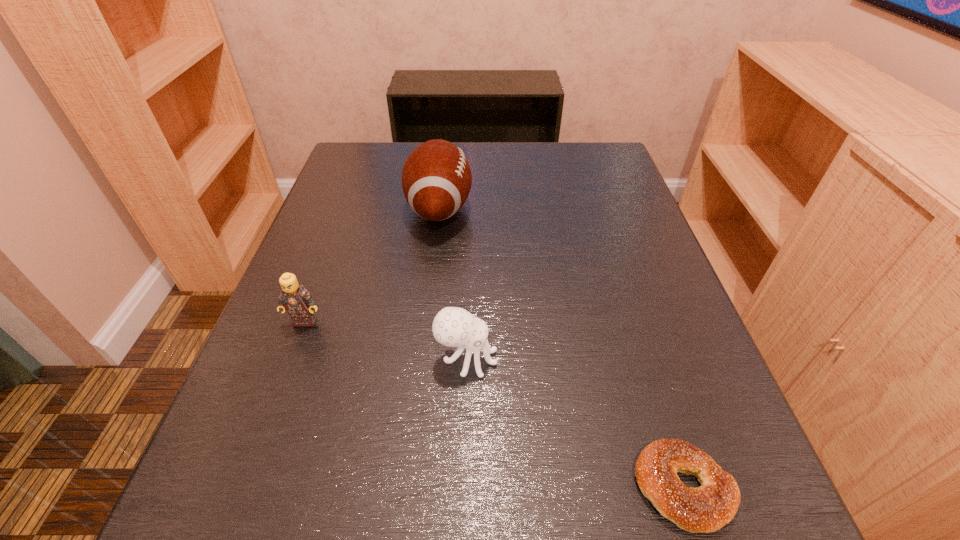
Identify the location of vacant space located 0.140m on the back of the rightmost object. The height and width of the screenshot is (540, 960). (643, 361).

Where is `object present at the far edge`? object present at the far edge is located at coordinates (436, 178).

What are the coordinates of `object that is at the near edge` in the screenshot? It's located at (707, 508).

This screenshot has height=540, width=960. What are the coordinates of `object that is at the left edge` in the screenshot? It's located at (294, 298).

Locate an element on the screen. object that is at the right edge is located at coordinates (707, 508).

The image size is (960, 540). I want to click on object that is at the near right corner, so click(707, 508).

The width and height of the screenshot is (960, 540). In order to click on free space at the far edge of the desktop in this screenshot , I will do `click(478, 180)`.

Locate an element on the screen. This screenshot has height=540, width=960. vacant region at the left edge of the desktop is located at coordinates 312,342.

Locate an element on the screen. free space at the right edge of the desktop is located at coordinates (660, 259).

This screenshot has height=540, width=960. I want to click on vacant space at the far left corner of the desktop, so click(372, 158).